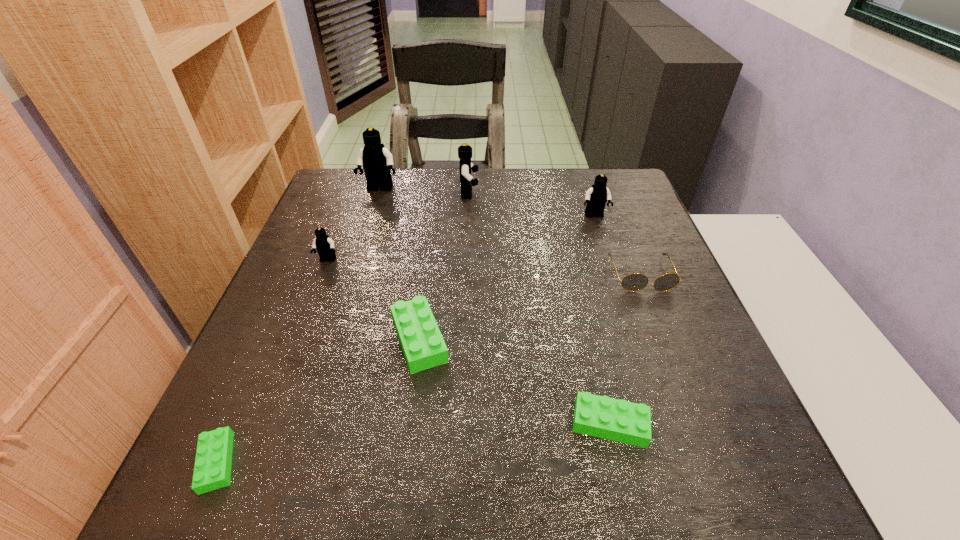
Find the location of `the sixth farthest object`. the sixth farthest object is located at coordinates (423, 346).

You are a GUI agent. You are given a task and a screenshot of the screen. Output one action in this format:
    pyautogui.click(x=<x>, y=<y>)
    Task: Click on the second shortest object
    This screenshot has width=960, height=540.
    Given the screenshot: What is the action you would take?
    pyautogui.click(x=600, y=416)

Where is `the second smallest green Lego`? The height and width of the screenshot is (540, 960). the second smallest green Lego is located at coordinates (600, 416).

Locate an element on the screen. This screenshot has width=960, height=540. the leftmost green Lego is located at coordinates (212, 470).

Where is `the shortest Lego`? The width and height of the screenshot is (960, 540). the shortest Lego is located at coordinates (212, 470).

You are a GUI agent. You are given a task and a screenshot of the screen. Output one action in this format:
    pyautogui.click(x=<x>, y=<y>)
    Task: Click on the free region located on the front-facing side of the tallest Lego
    
    Given the screenshot: What is the action you would take?
    pyautogui.click(x=366, y=234)

At what (x,y) coordinates should I click in order to perform the action: click on vacant space situated 0.290m on the front-facing side of the sixth shortest Lego. Please return your answer as a coordinate pair (x, y). The width and height of the screenshot is (960, 540). Looking at the image, I should click on (580, 193).

The width and height of the screenshot is (960, 540). What are the coordinates of `vacant space located on the front-facing side of the sixth shortest object` in the screenshot? It's located at (616, 284).

This screenshot has width=960, height=540. What are the coordinates of `vacant space located 0.130m on the front-facing side of the fourth shortest Lego` in the screenshot? It's located at (310, 305).

You are a GUI agent. You are given a task and a screenshot of the screen. Output one action in this format:
    pyautogui.click(x=<x>, y=<y>)
    Task: Click on the free spot located on the lenses of the gray sunglasses
    
    Given the screenshot: What is the action you would take?
    pyautogui.click(x=720, y=477)